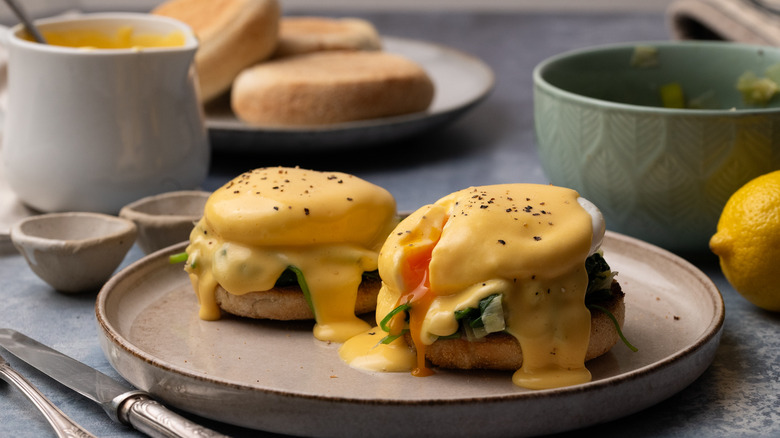
Where is `cup`? cup is located at coordinates (647, 157).